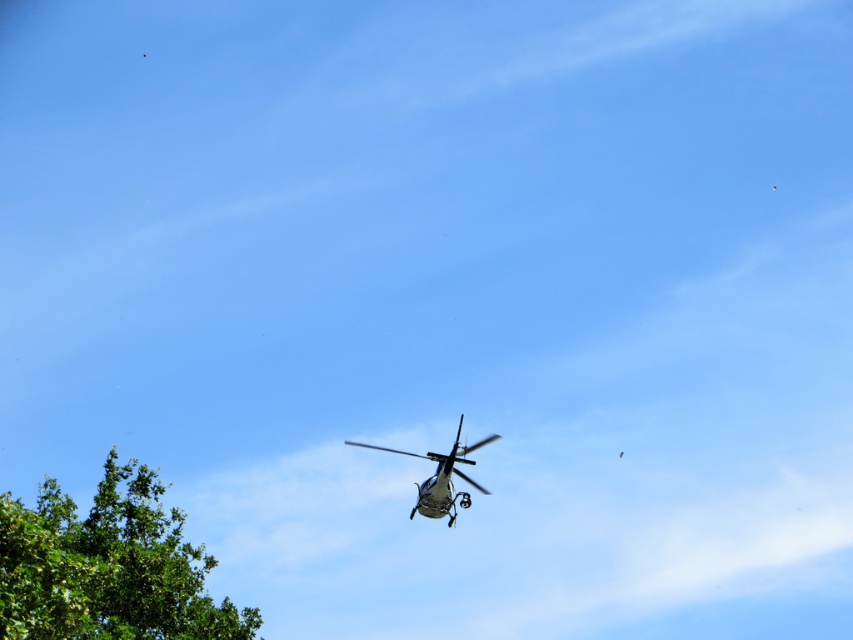
Which is more to the left, green leafy tree at lower left or metallic silver helicopter at center?

green leafy tree at lower left is more to the left.

Is point (125, 627) farther from viewer compared to point (434, 458)?

Yes, it is behind point (434, 458).

You are a GUI agent. You are given a task and a screenshot of the screen. Output one action in this format:
    pyautogui.click(x=<x>, y=<y>)
    Task: Click on the green leafy tree at lower left
    This screenshot has height=640, width=853.
    Given the screenshot: What is the action you would take?
    pyautogui.click(x=107, y=566)